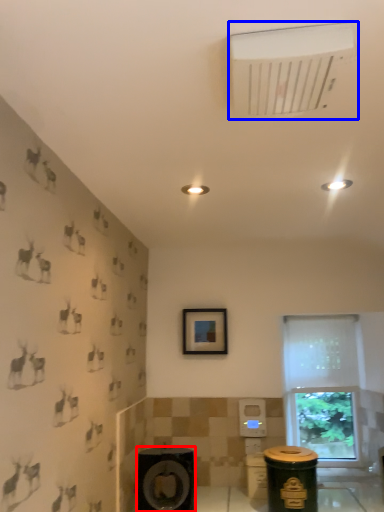
Question: Which point is further to the camera, speaker (highlighted by a red box) or air conditioning (highlighted by a blue box)?

Choices:
 (A) speaker
 (B) air conditioning

Answer: (A)